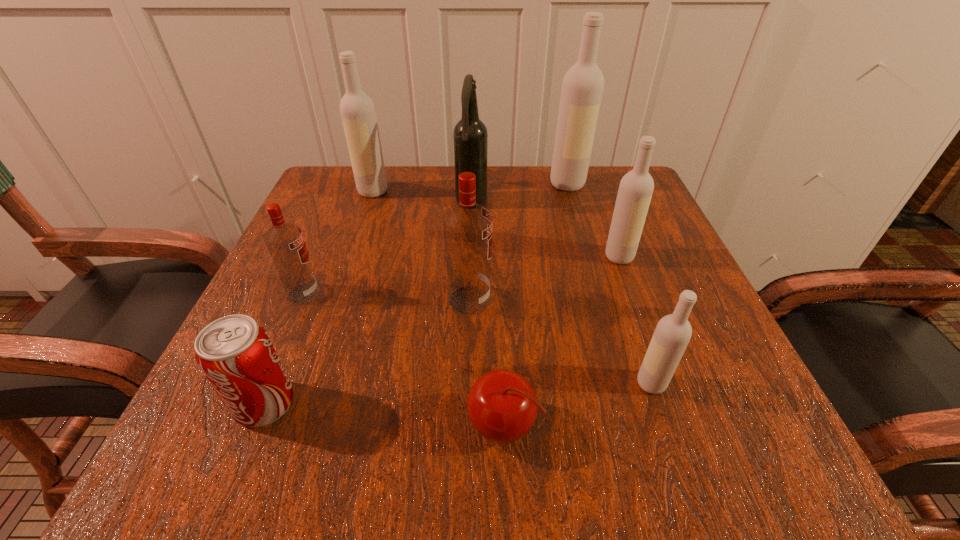
Choose which white vodka is the third nearest neighbor to the third farthest white vodka. Please provide its 2D coordinates. Your answer should be formatted as a tuple, i.e. [(x, y)], where the tuple contains the x and y coordinates of a point satisfying the conditions above.

[(357, 110)]

Identify the location of blank area in the image that satisfies the following two spatial constraints: 1. on the front side of the fourth farthest object; 2. on the front label of the smaller red vodka. (633, 293).

Image resolution: width=960 pixels, height=540 pixels. Find the location of `free space that satisfies the following two spatial constraints: 1. on the front label of the right red vodka; 2. on the back side of the shortest object`. free space that satisfies the following two spatial constraints: 1. on the front label of the right red vodka; 2. on the back side of the shortest object is located at coordinates (467, 426).

Find the location of a particular element. vacant space that satisfies the following two spatial constraints: 1. on the front label of the soda can; 2. on the right side of the left red vodka is located at coordinates (256, 404).

The image size is (960, 540). I want to click on free spot that satisfies the following two spatial constraints: 1. on the front side of the third smallest white vodka; 2. on the right side of the third farthest vodka, so click(x=350, y=256).

This screenshot has height=540, width=960. I want to click on free space that satisfies the following two spatial constraints: 1. on the front side of the fourth nearest vodka; 2. on the left side of the second biggest white vodka, so [x=350, y=256].